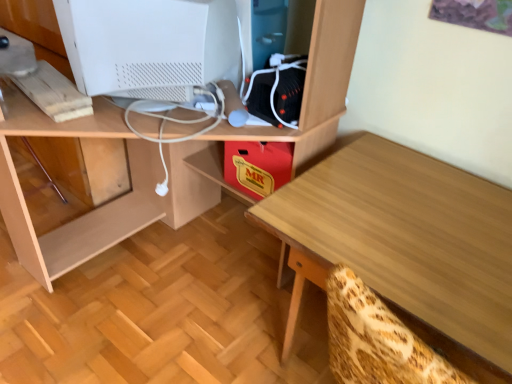
Question: In terms of height, does light wood table at center look taller or shorter compared to wooden desk at center?

Choices:
 (A) tall
 (B) short

Answer: (B)

Question: Is light wood table at center situated inside wooden desk at center or outside?

Choices:
 (A) outside
 (B) inside

Answer: (A)

Question: Based on their relative distances, which object is nearer to the wooden desk at center?

Choices:
 (A) light wood table at center
 (B) white matte computer monitor at upper left

Answer: (B)

Question: Estimate the real-world distances between objects in this image. Which object is farther from the white matte computer monitor at upper left?

Choices:
 (A) wooden desk at center
 (B) light wood table at center

Answer: (B)